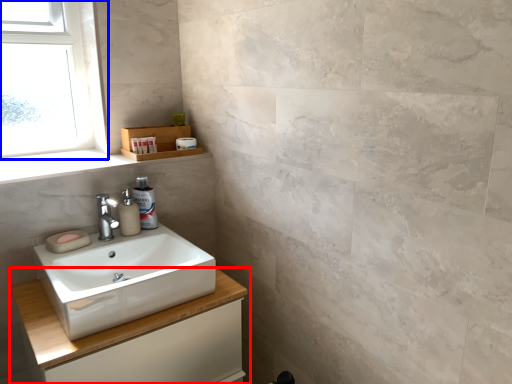
Question: Among these objects, which one is nearest to the camera, bathroom cabinet (highlighted by a red box) or window (highlighted by a blue box)?

Choices:
 (A) bathroom cabinet
 (B) window

Answer: (A)